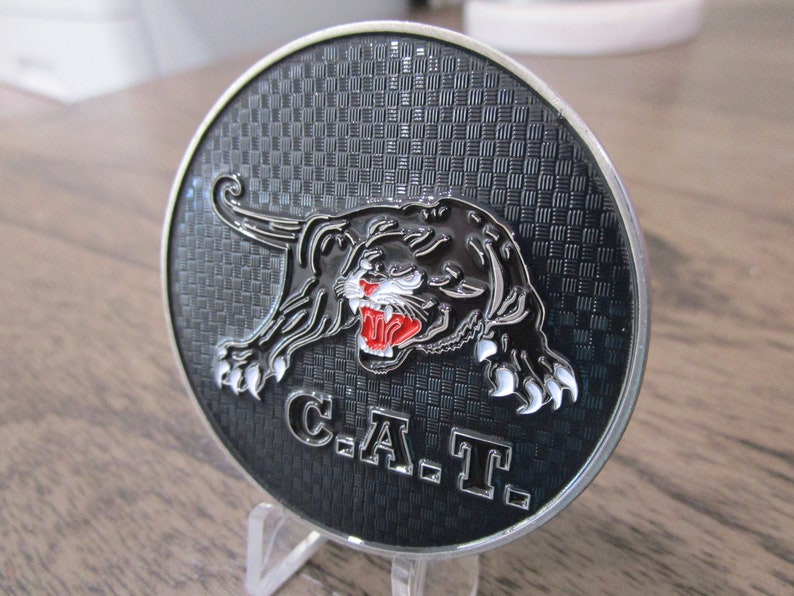
The width and height of the screenshot is (794, 596). What are the coordinates of `glass stand` in the screenshot? It's located at (283, 545), (453, 575).